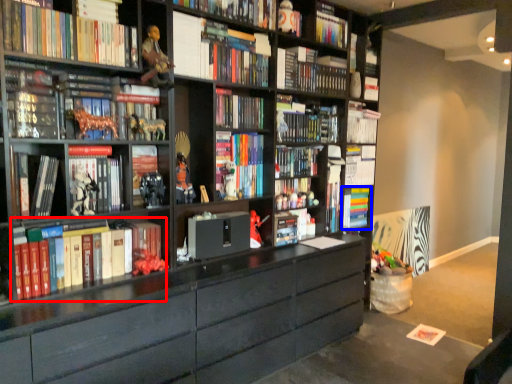
Question: Which point is closer to the camera, book (highlighted by a red box) or book (highlighted by a blue box)?

Choices:
 (A) book
 (B) book

Answer: (A)